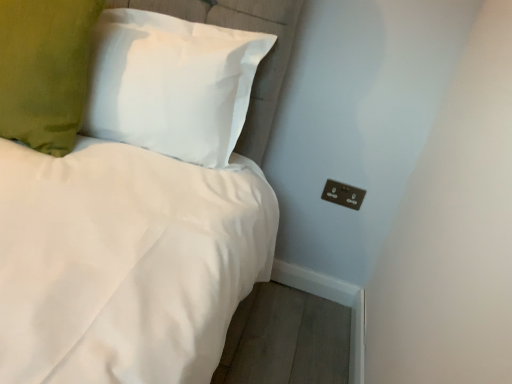
Question: Is black plastic outlet at lower right shorter than green velvet pillow at upper left, the second pillow from the right?

Choices:
 (A) yes
 (B) no

Answer: (A)

Question: Is the position of black plastic outlet at lower right less distant than that of green velvet pillow at upper left, arranged as the first pillow when viewed from the left?

Choices:
 (A) yes
 (B) no

Answer: (B)

Question: Would you say black plastic outlet at lower right is outside green velvet pillow at upper left, arranged as the first pillow when viewed from the left?

Choices:
 (A) no
 (B) yes

Answer: (B)

Question: From a real-world perspective, is black plastic outlet at lower right below green velvet pillow at upper left, the second pillow from the right?

Choices:
 (A) yes
 (B) no

Answer: (A)

Question: From a real-world perspective, is black plastic outlet at lower right on top of green velvet pillow at upper left, arranged as the first pillow when viewed from the left?

Choices:
 (A) yes
 (B) no

Answer: (B)

Question: Considering the positions of point (59, 91) and point (329, 180), is point (59, 91) closer or farther from the camera than point (329, 180)?

Choices:
 (A) farther
 (B) closer

Answer: (B)

Question: From a real-world perspective, relative to black plastic outlet at lower right, is green velvet pillow at upper left, the second pillow from the right, vertically above or below?

Choices:
 (A) below
 (B) above

Answer: (B)

Question: Considering the positions of green velvet pillow at upper left, the second pillow from the right, and black plastic outlet at lower right in the image, is green velvet pillow at upper left, the second pillow from the right, bigger or smaller than black plastic outlet at lower right?

Choices:
 (A) small
 (B) big

Answer: (B)

Question: In terms of height, does green velvet pillow at upper left, the second pillow from the right, look taller or shorter compared to black plastic outlet at lower right?

Choices:
 (A) short
 (B) tall

Answer: (B)

Question: Considering the positions of green velvet pillow at upper left, arranged as the first pillow when viewed from the left, and white fabric pillow at upper left, which is counted as the second pillow, starting from the left, in the image, is green velvet pillow at upper left, arranged as the first pillow when viewed from the left, taller or shorter than white fabric pillow at upper left, which is counted as the second pillow, starting from the left,?

Choices:
 (A) tall
 (B) short

Answer: (A)

Question: Looking at their shapes, would you say green velvet pillow at upper left, the second pillow from the right, is wider or thinner than white fabric pillow at upper left, which is counted as the second pillow, starting from the left?

Choices:
 (A) thin
 (B) wide

Answer: (B)

Question: From a real-world perspective, is green velvet pillow at upper left, arranged as the first pillow when viewed from the left, above or below white fabric pillow at upper left, the 1th pillow from the right?

Choices:
 (A) above
 (B) below

Answer: (B)

Question: Is green velvet pillow at upper left, the second pillow from the right, in front of or behind white fabric pillow at upper left, the 1th pillow from the right, in the image?

Choices:
 (A) front
 (B) behind

Answer: (A)

Question: Is black plastic outlet at lower right taller or shorter than white fabric pillow at upper left, the 1th pillow from the right?

Choices:
 (A) tall
 (B) short

Answer: (B)

Question: From a real-world perspective, is black plastic outlet at lower right above or below white fabric pillow at upper left, the 1th pillow from the right?

Choices:
 (A) above
 (B) below

Answer: (B)